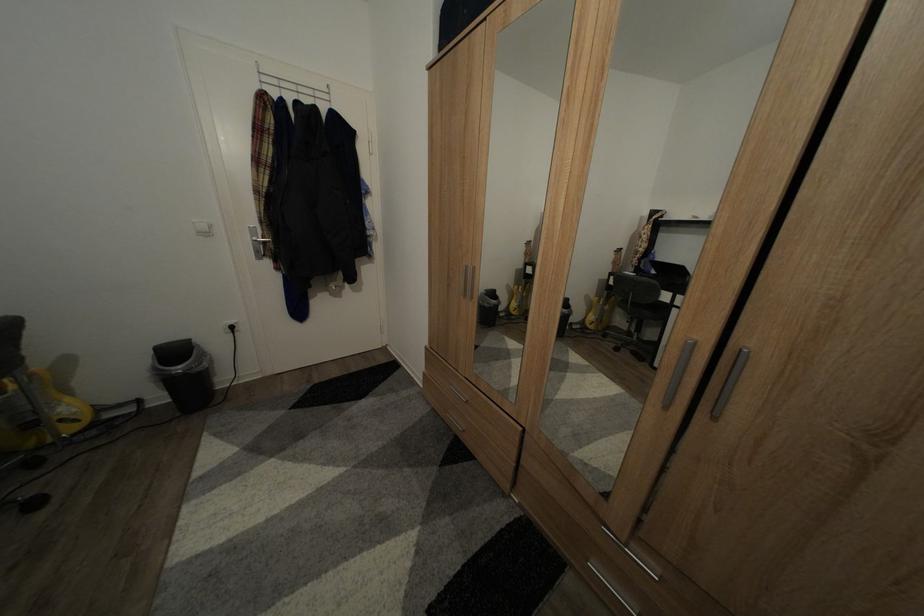
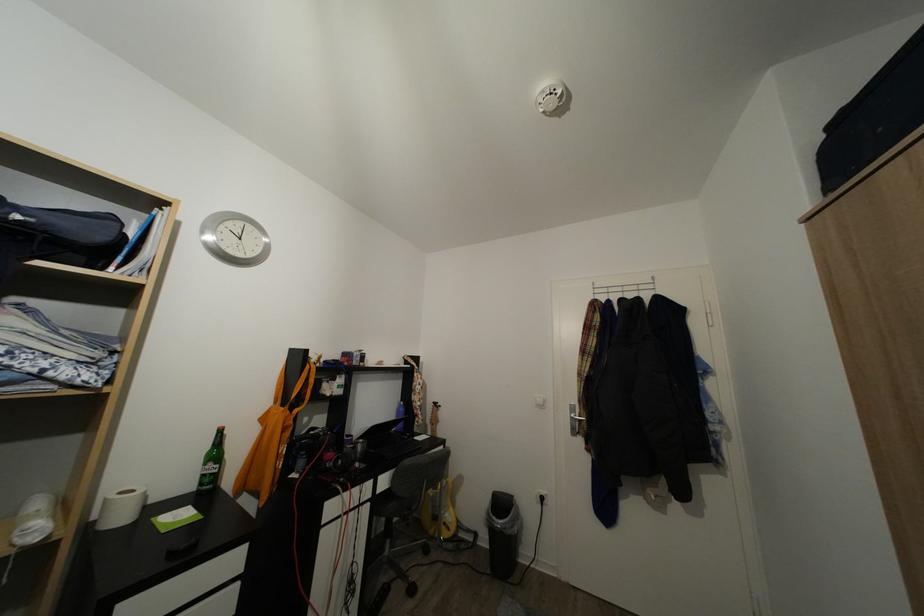
How did the camera likely rotate?

The camera's rotation is toward left-up.